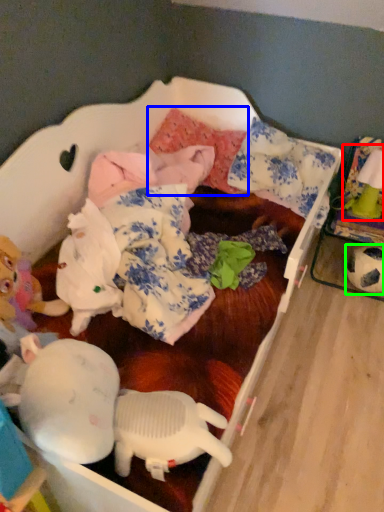
Question: Considering the real-world distances, which object is closest to toy (highlighted by a red box)? pillow (highlighted by a blue box) or toy (highlighted by a green box).

Choices:
 (A) pillow
 (B) toy

Answer: (B)